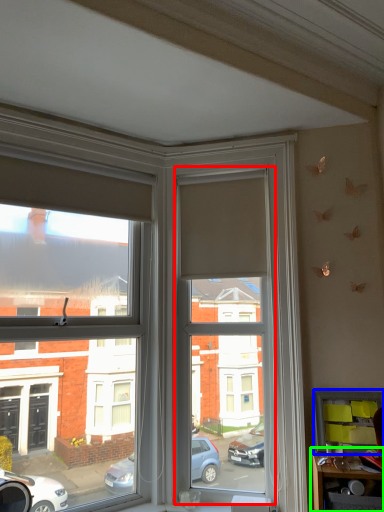
Question: Based on their relative distances, which object is farther from window screen (highlighted by a red box)? Choose from shelf (highlighted by a blue box) and table (highlighted by a green box).

Choices:
 (A) shelf
 (B) table

Answer: (B)